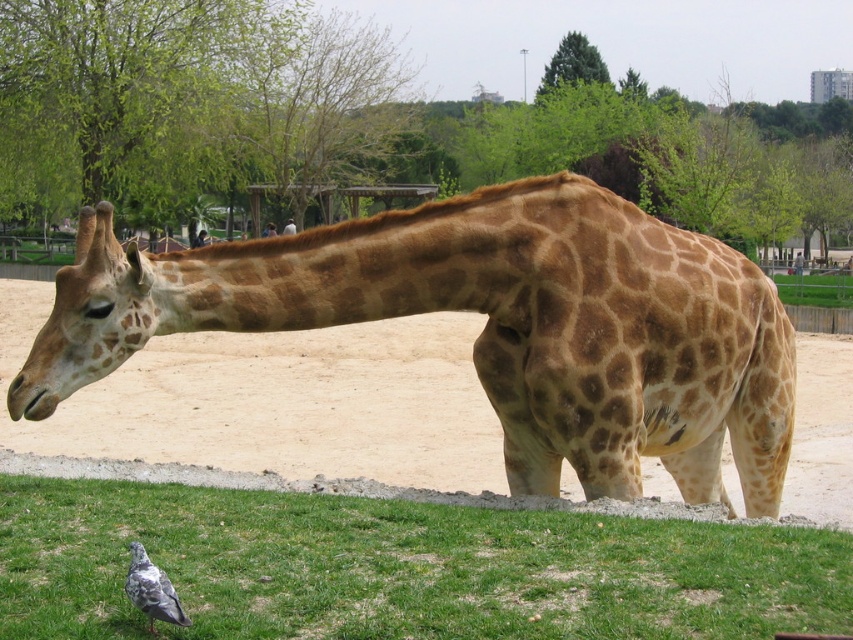
Can you confirm if brown spotted giraffe at center is shorter than gray feathered pigeon at lower left?

No.

Can you confirm if brown spotted giraffe at center is thinner than gray feathered pigeon at lower left?

No.

Which is in front, point (645, 273) or point (143, 563)?

Positioned in front is point (143, 563).

I want to click on brown spotted giraffe at center, so click(486, 326).

Which is below, green grass at lower left or brown spotted neck at center?

Positioned lower is green grass at lower left.

Is green grass at lower left taller than brown spotted neck at center?

Incorrect, green grass at lower left's height is not larger of brown spotted neck at center's.

Image resolution: width=853 pixels, height=640 pixels. I want to click on green grass at lower left, so click(x=399, y=566).

How far apart are brown spotted giraffe at center and green grass at lower left?

brown spotted giraffe at center and green grass at lower left are 4.13 feet apart from each other.

Find the location of `brown spotted giraffe at center`. brown spotted giraffe at center is located at coordinates (486, 326).

Is point (767, 369) farther from viewer compared to point (474, 577)?

Yes, it is.

Where is `brown spotted giraffe at center`? The height and width of the screenshot is (640, 853). brown spotted giraffe at center is located at coordinates (486, 326).